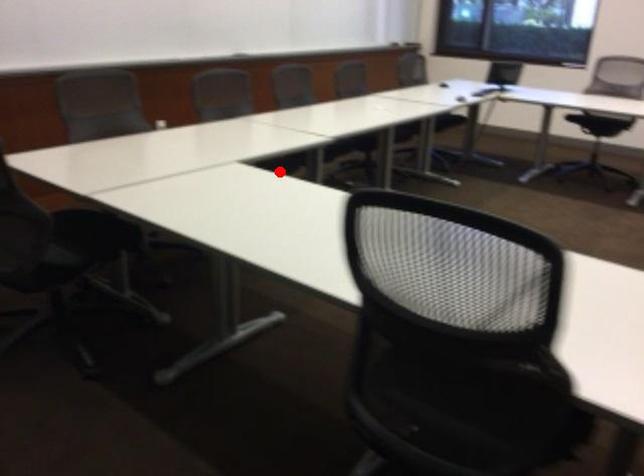
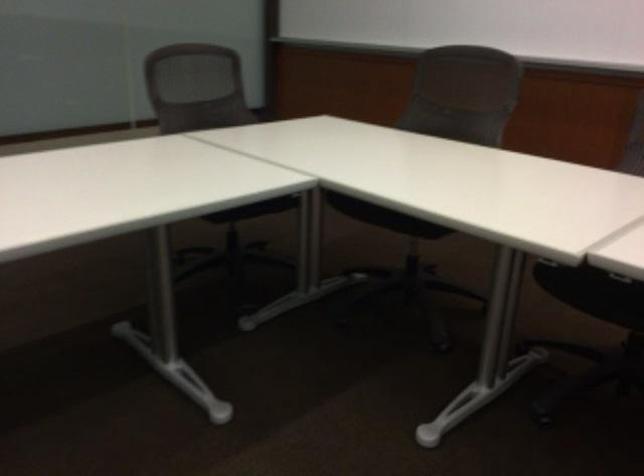
Locate, in the second image, the point that corresponds to the highlighted location in the first image.

(592, 292)